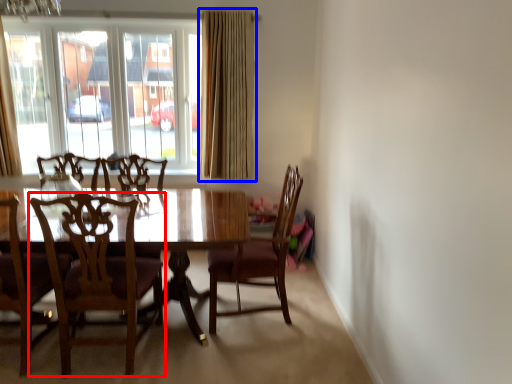
Question: Which of the following is the farthest to the observer, chair (highlighted by a red box) or curtain (highlighted by a blue box)?

Choices:
 (A) chair
 (B) curtain

Answer: (B)